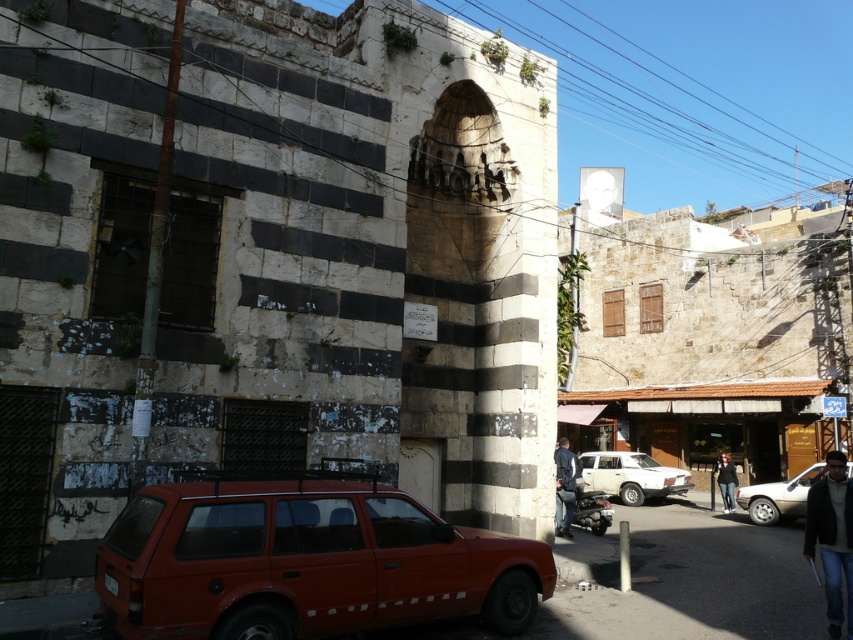
Is point (753, 532) positioned after point (728, 508)?

No, (753, 532) is in front of (728, 508).

You are a GUI agent. You are given a task and a screenshot of the screen. Output one action in this format:
    pyautogui.click(x=<x>, y=<y>)
    Task: Click on the smooth asphalt alley at lower right
    
    Given the screenshot: What is the action you would take?
    pyautogui.click(x=695, y=580)

Does point (610, 589) come behind point (730, 490)?

No, it is in front of (730, 490).

Find the location of a particular element. smooth asphalt alley at lower right is located at coordinates (695, 580).

Between jeans at lower right and silver metallic sedan at lower right, which one appears on the left side from the viewer's perspective?

Positioned to the left is jeans at lower right.

Does jeans at lower right have a smaller size compared to silver metallic sedan at lower right?

Actually, jeans at lower right might be larger than silver metallic sedan at lower right.

Is point (827, 461) farther from camera compared to point (793, 484)?

Yes, it is.

In order to click on jeans at lower right in this screenshot , I will do `click(833, 538)`.

Can you confirm if rusty matte suv at lower left is smaller than silver metallic sedan at lower right?

No, rusty matte suv at lower left is not smaller than silver metallic sedan at lower right.

Who is shorter, rusty matte suv at lower left or silver metallic sedan at lower right?

silver metallic sedan at lower right

This screenshot has height=640, width=853. Identify the location of rusty matte suv at lower left. (305, 563).